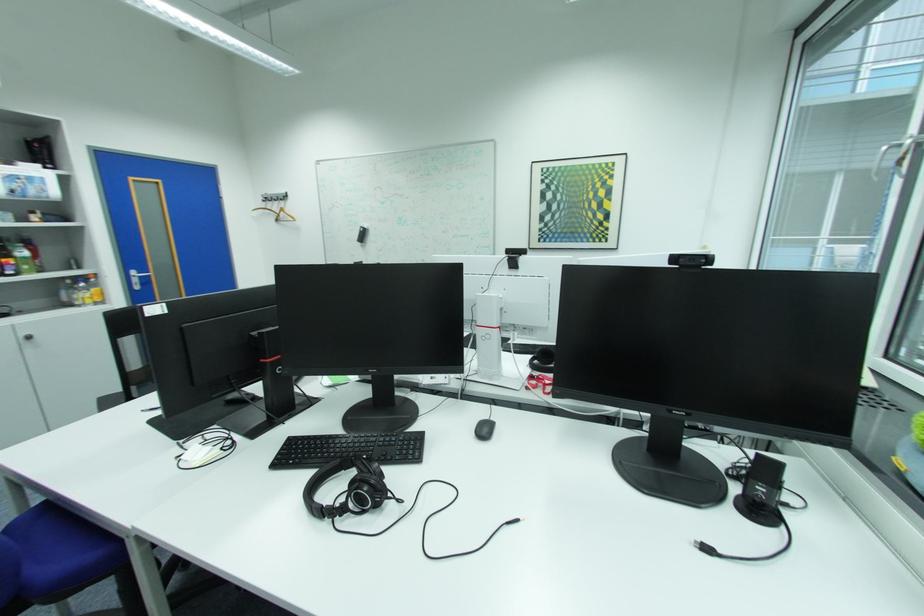
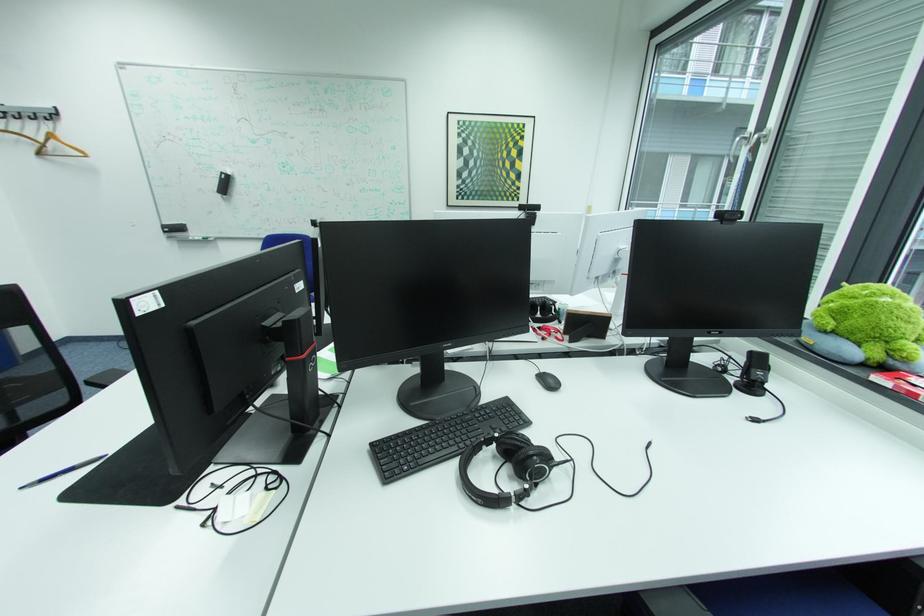
In the second image, find the point that corresponds to pixel 494 430 in the first image.

(560, 382)